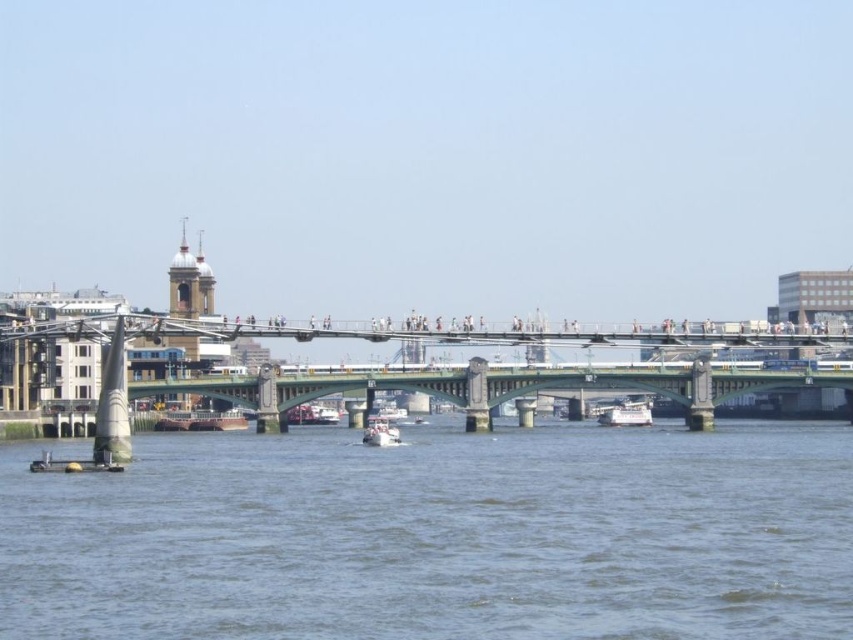
Which is in front, point (606, 412) or point (381, 428)?

Positioned in front is point (381, 428).

Can you confirm if white glossy boat at center is smaller than white plastic boat at center?

Yes.

Is point (624, 426) farther from camera compared to point (397, 435)?

Yes, it is.

Where is `white glossy boat at center`? The height and width of the screenshot is (640, 853). white glossy boat at center is located at coordinates (625, 413).

Between point (128, 433) and point (399, 438), which one is positioned behind?

Positioned behind is point (399, 438).

Who is more distant from viewer, (68,467) or (381,442)?

Point (381,442)

Where is `metallic gray boat at lower left`? Image resolution: width=853 pixels, height=640 pixels. metallic gray boat at lower left is located at coordinates (103, 419).

Does point (170, 422) come in front of point (378, 424)?

No, (170, 422) is further to viewer.

Who is lower down, brown wooden boat at center or white plastic boat at center?

Positioned lower is white plastic boat at center.

This screenshot has width=853, height=640. What are the coordinates of `brown wooden boat at center` in the screenshot? It's located at (201, 420).